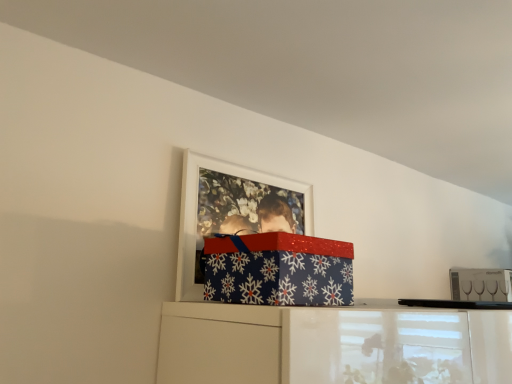
Question: Does blue paper with snowflakes at upper center have a lesser height compared to clear glass wine glasses at upper right?

Choices:
 (A) yes
 (B) no

Answer: (B)

Question: Would you say clear glass wine glasses at upper right is part of blue paper with snowflakes at upper center's contents?

Choices:
 (A) yes
 (B) no

Answer: (B)

Question: Is blue paper with snowflakes at upper center turned away from clear glass wine glasses at upper right?

Choices:
 (A) yes
 (B) no

Answer: (B)

Question: Is blue paper with snowflakes at upper center at the right side of clear glass wine glasses at upper right?

Choices:
 (A) yes
 (B) no

Answer: (B)

Question: From the image's perspective, is blue paper with snowflakes at upper center located above clear glass wine glasses at upper right?

Choices:
 (A) no
 (B) yes

Answer: (B)

Question: Considering their positions, is clear glass wine glasses at upper right located in front of or behind blue paper with snowflakes at upper center?

Choices:
 (A) behind
 (B) front

Answer: (A)

Question: Considering the positions of clear glass wine glasses at upper right and blue paper with snowflakes at upper center in the image, is clear glass wine glasses at upper right wider or thinner than blue paper with snowflakes at upper center?

Choices:
 (A) thin
 (B) wide

Answer: (A)

Question: In terms of size, does clear glass wine glasses at upper right appear bigger or smaller than blue paper with snowflakes at upper center?

Choices:
 (A) small
 (B) big

Answer: (A)

Question: In terms of height, does clear glass wine glasses at upper right look taller or shorter compared to blue paper with snowflakes at upper center?

Choices:
 (A) short
 (B) tall

Answer: (A)

Question: In the image, is blue paper with snowflakes at upper center positioned in front of or behind clear glass wine glasses at upper right?

Choices:
 (A) behind
 (B) front

Answer: (B)

Question: In terms of width, does blue paper with snowflakes at upper center look wider or thinner when compared to clear glass wine glasses at upper right?

Choices:
 (A) wide
 (B) thin

Answer: (A)

Question: Do you think blue paper with snowflakes at upper center is within clear glass wine glasses at upper right, or outside of it?

Choices:
 (A) inside
 (B) outside

Answer: (B)

Question: From the image's perspective, is blue paper with snowflakes at upper center located above or below clear glass wine glasses at upper right?

Choices:
 (A) above
 (B) below

Answer: (A)

Question: Does point (194, 240) appear closer or farther from the camera than point (483, 281)?

Choices:
 (A) farther
 (B) closer

Answer: (B)

Question: From the image's perspective, is white matte picture frame at upper center above or below clear glass wine glasses at upper right?

Choices:
 (A) below
 (B) above

Answer: (B)